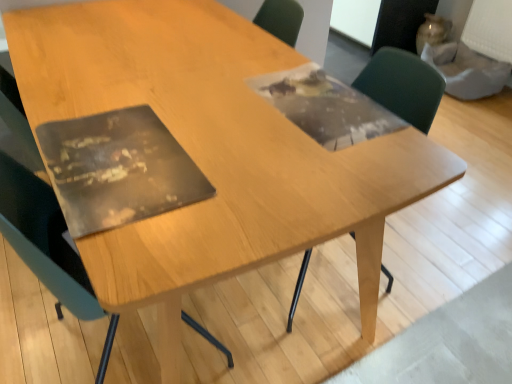
Question: Can you confirm if green plastic chair at upper right, which is the 2th chair from left to right, is bigger than matte black chair at left, arranged as the 2th chair when viewed from the right?

Choices:
 (A) no
 (B) yes

Answer: (A)

Question: Considering the relative positions of green plastic chair at upper right, the 1th chair viewed from the right, and matte black chair at left, arranged as the 2th chair when viewed from the right, in the image provided, is green plastic chair at upper right, the 1th chair viewed from the right, in front of matte black chair at left, arranged as the 2th chair when viewed from the right,?

Choices:
 (A) yes
 (B) no

Answer: (B)

Question: Can you confirm if green plastic chair at upper right, the 1th chair viewed from the right, is wider than matte black chair at left, arranged as the 2th chair when viewed from the right?

Choices:
 (A) no
 (B) yes

Answer: (A)

Question: Is matte black chair at left, arranged as the 2th chair when viewed from the right, surrounded by green plastic chair at upper right, the 1th chair viewed from the right?

Choices:
 (A) yes
 (B) no

Answer: (B)

Question: Does green plastic chair at upper right, which is the 2th chair from left to right, appear on the right side of matte black chair at left, the first chair when ordered from left to right?

Choices:
 (A) yes
 (B) no

Answer: (A)

Question: Considering the relative sizes of green plastic chair at upper right, which is the 2th chair from left to right, and matte black chair at left, arranged as the 2th chair when viewed from the right, in the image provided, is green plastic chair at upper right, which is the 2th chair from left to right, thinner than matte black chair at left, arranged as the 2th chair when viewed from the right,?

Choices:
 (A) no
 (B) yes

Answer: (B)

Question: Are matte black chair at left, the first chair when ordered from left to right, and green plastic chair at upper right, the 1th chair viewed from the right, located far from each other?

Choices:
 (A) no
 (B) yes

Answer: (B)

Question: Does matte black chair at left, the first chair when ordered from left to right, have a greater height compared to green plastic chair at upper right, which is the 2th chair from left to right?

Choices:
 (A) yes
 (B) no

Answer: (A)

Question: Considering the relative sizes of matte black chair at left, arranged as the 2th chair when viewed from the right, and green plastic chair at upper right, the 1th chair viewed from the right, in the image provided, is matte black chair at left, arranged as the 2th chair when viewed from the right, wider than green plastic chair at upper right, the 1th chair viewed from the right,?

Choices:
 (A) yes
 (B) no

Answer: (A)

Question: Is matte black chair at left, arranged as the 2th chair when viewed from the right, at the right side of green plastic chair at upper right, which is the 2th chair from left to right?

Choices:
 (A) no
 (B) yes

Answer: (A)

Question: Is green plastic chair at upper right, the 1th chair viewed from the right, a part of matte black chair at left, the first chair when ordered from left to right?

Choices:
 (A) no
 (B) yes

Answer: (A)

Question: Does matte black chair at left, arranged as the 2th chair when viewed from the right, appear on the left side of green plastic chair at upper right, the 1th chair viewed from the right?

Choices:
 (A) no
 (B) yes

Answer: (B)

Question: Choose the correct answer: Is matte black chair at left, arranged as the 2th chair when viewed from the right, inside green plastic chair at upper right, which is the 2th chair from left to right, or outside it?

Choices:
 (A) inside
 (B) outside

Answer: (B)